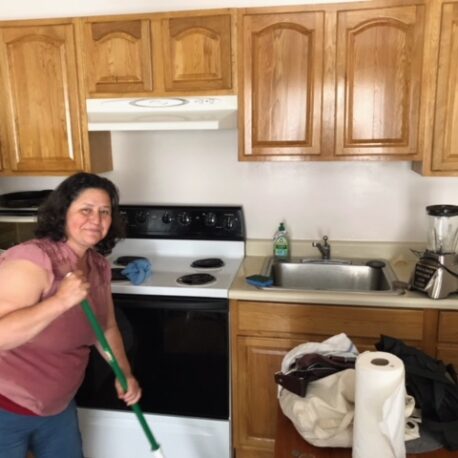
Locate an element on the screen. This screenshot has width=458, height=458. stainless steel sink is located at coordinates (348, 282).